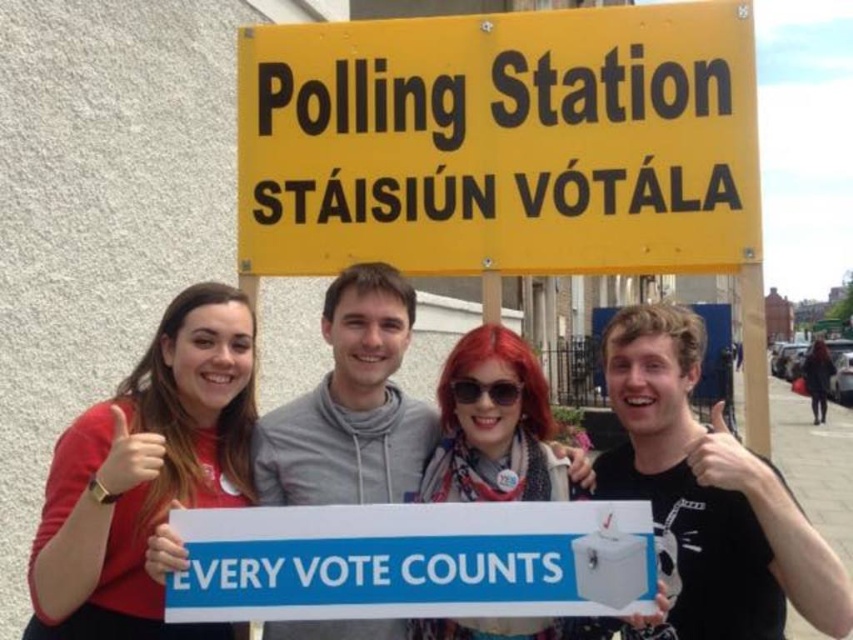
Is white paper sign at center below black matte sign at upper center?

No, white paper sign at center is not below black matte sign at upper center.

Which is in front, point (173, 580) or point (633, 499)?

Positioned in front is point (173, 580).

Is point (358, 593) less distant than point (625, 332)?

Yes, it is in front of point (625, 332).

Find the location of a particular element. This screenshot has width=853, height=640. white paper sign at center is located at coordinates (415, 561).

Does yellow plastic sign at upper center have a greater width compared to white paper sign at center?

Indeed, yellow plastic sign at upper center has a greater width compared to white paper sign at center.

Can you confirm if yellow plastic sign at upper center is smaller than white paper sign at center?

Incorrect, yellow plastic sign at upper center is not smaller in size than white paper sign at center.

This screenshot has height=640, width=853. In order to click on yellow plastic sign at upper center in this screenshot , I will do `click(502, 141)`.

Between point (625, 244) and point (198, 371), which one is positioned behind?

Point (625, 244)

Who is more forward, (299,243) or (199,330)?

Point (199,330) is more forward.

Measure the distance between yellow plastic sign at upper center and camera.

7.85 meters

At what (x,y) coordinates should I click in order to perform the action: click on yellow plastic sign at upper center. Please return your answer as a coordinate pair (x, y). Looking at the image, I should click on (502, 141).